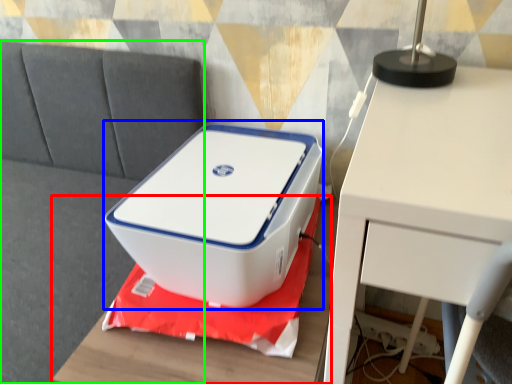
Question: Considering the real-world distances, which object is farthest from furniture (highlighted by a red box)? storage box (highlighted by a blue box) or couch (highlighted by a green box)?

Choices:
 (A) storage box
 (B) couch

Answer: (B)